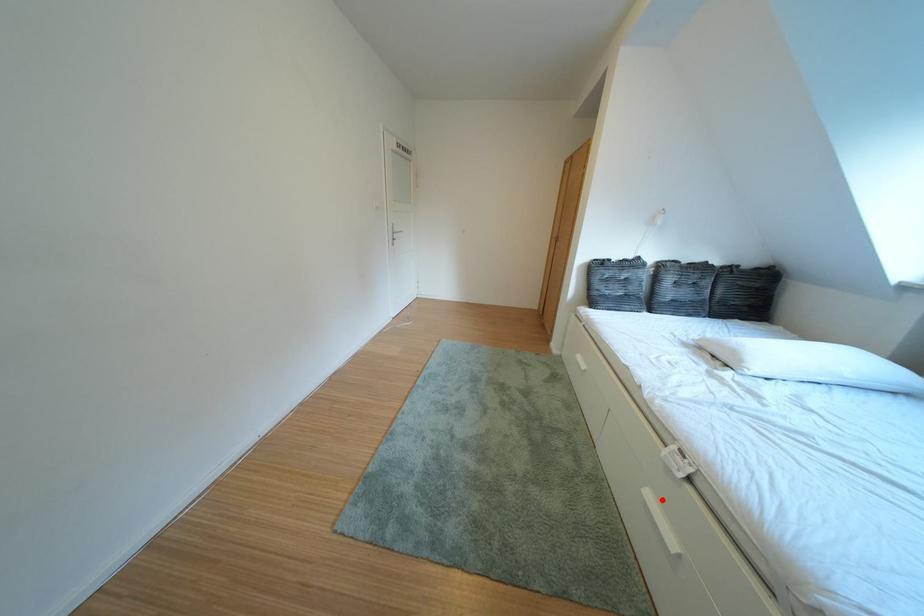
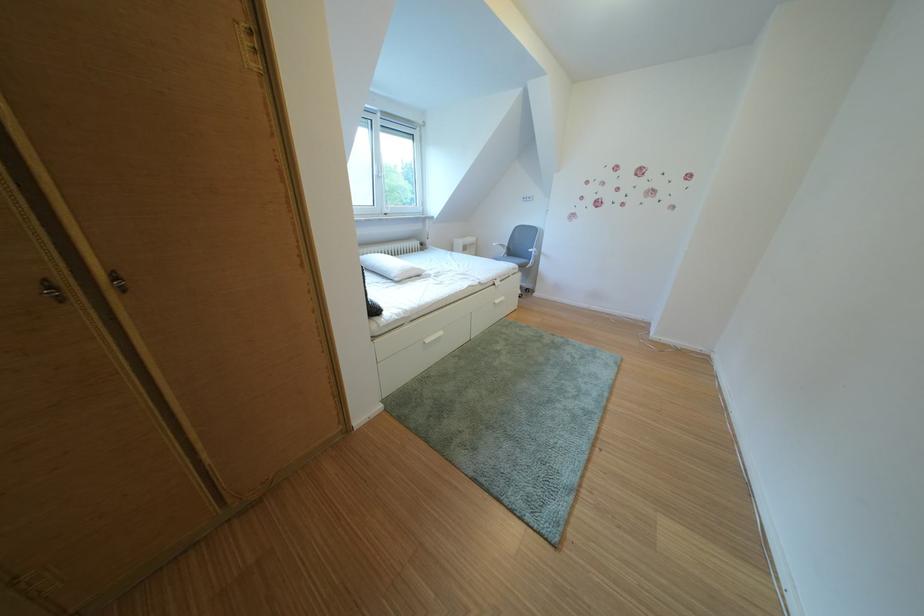
In the second image, find the point that corresponds to the highlighted location in the first image.

(511, 307)